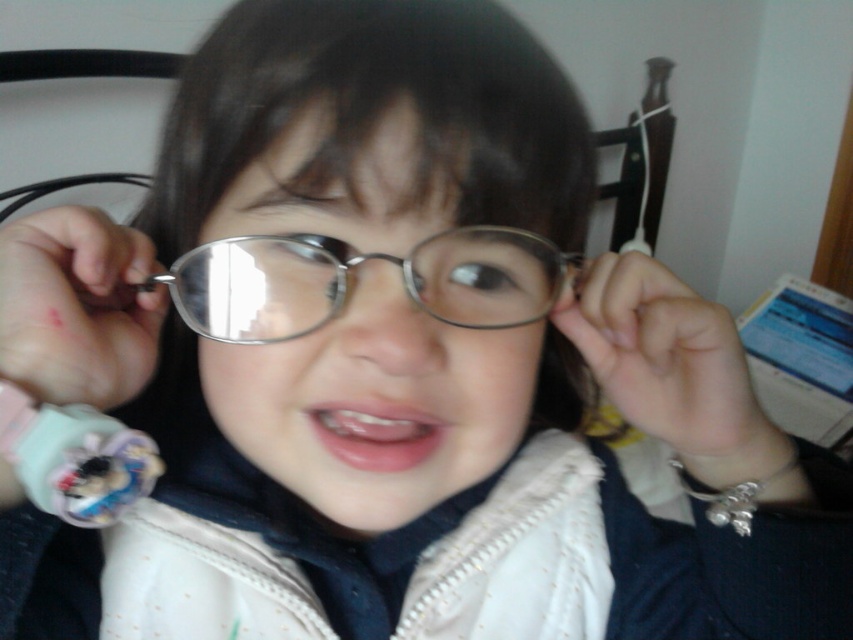
Question: Estimate the real-world distances between objects in this image. Which object is closer to the plush fabric toy at lower left?

Choices:
 (A) metallic round glasses at center
 (B) metallic reflective glasses at center

Answer: (B)

Question: Based on their relative distances, which object is farther from the metallic reflective glasses at center?

Choices:
 (A) metallic round glasses at center
 (B) plush fabric toy at lower left

Answer: (B)

Question: Is metallic reflective glasses at center below metallic round glasses at center?

Choices:
 (A) no
 (B) yes

Answer: (B)

Question: Can you confirm if metallic reflective glasses at center is positioned to the left of plush fabric toy at lower left?

Choices:
 (A) yes
 (B) no

Answer: (B)

Question: Which of the following is the farthest from the observer?

Choices:
 (A) (463, 292)
 (B) (115, 445)
 (C) (532, 371)

Answer: (C)

Question: Is metallic reflective glasses at center wider than plush fabric toy at lower left?

Choices:
 (A) no
 (B) yes

Answer: (B)